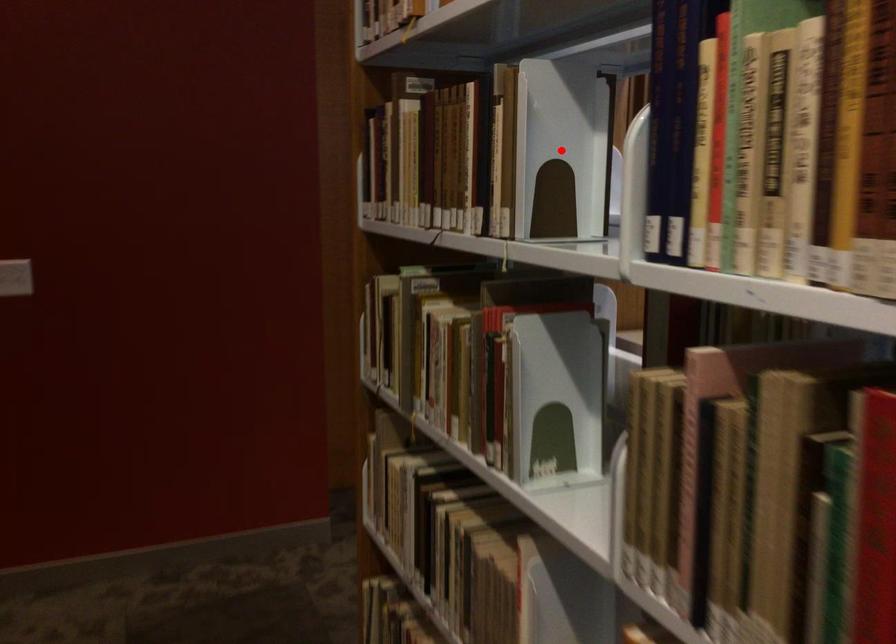
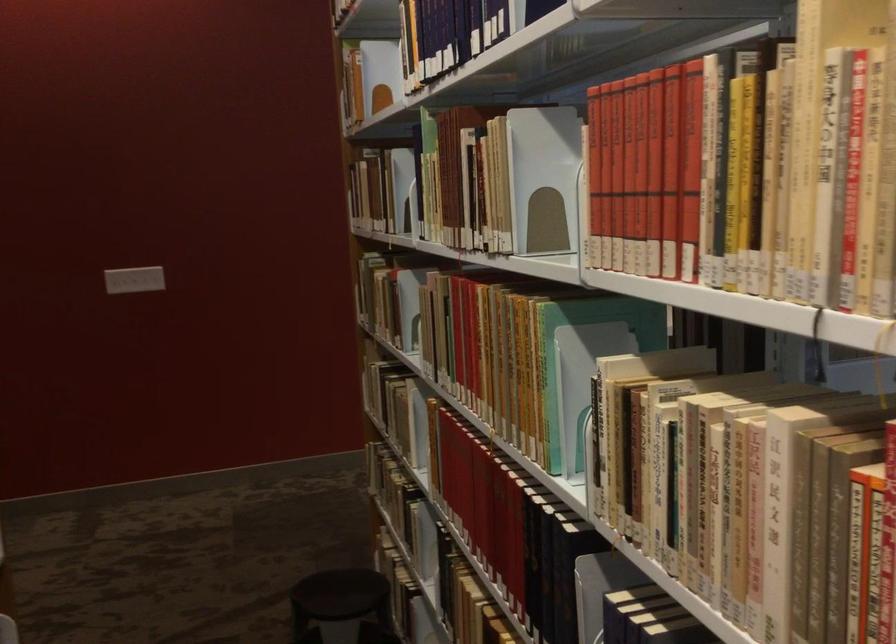
Question: I am providing you with two images of the same scene from different viewpoints. A red point is marked on the first image. At the location where the point appears in image 1, is it still visible in image 2?

Choices:
 (A) Yes
 (B) No

Answer: (B)